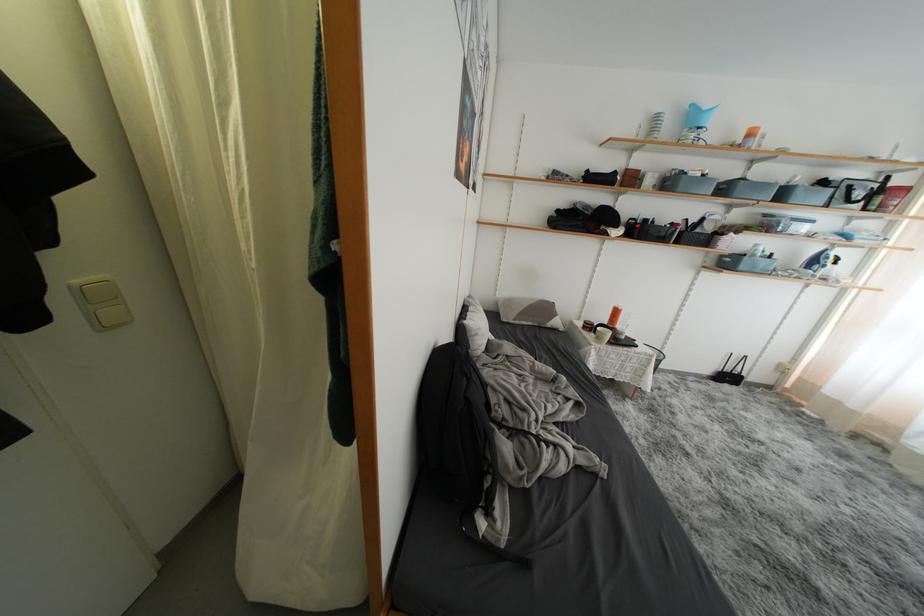
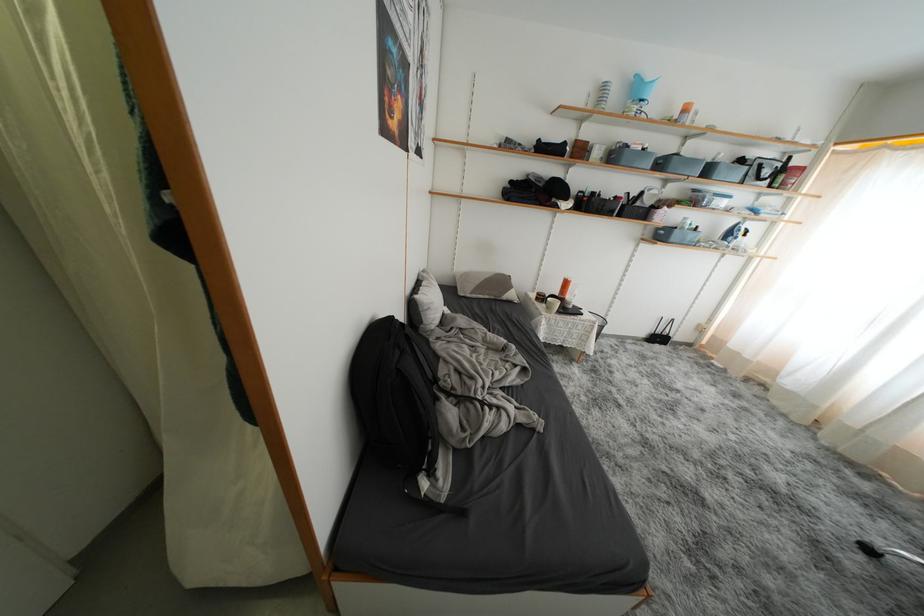
In the second image, find the point that corresponds to (x=552, y=312) in the first image.

(508, 286)